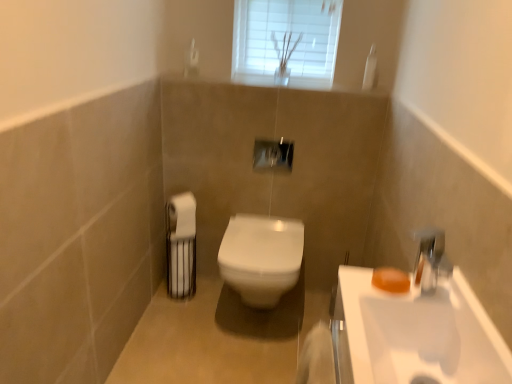
This screenshot has width=512, height=384. I want to click on free spot to the left of orange matte soap at right, so click(355, 286).